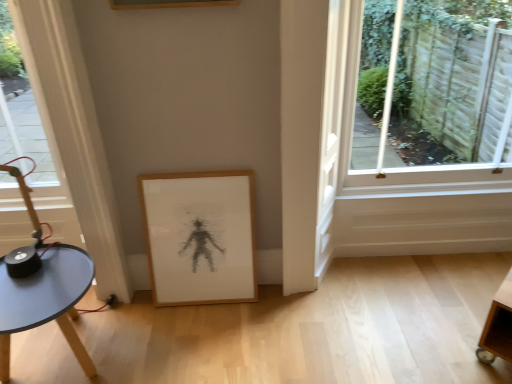
Question: Considering the positions of clear glass window at upper right and wooden picture frame at lower center in the image, is clear glass window at upper right taller or shorter than wooden picture frame at lower center?

Choices:
 (A) tall
 (B) short

Answer: (A)

Question: Considering the positions of clear glass window at upper right and wooden picture frame at lower center in the image, is clear glass window at upper right bigger or smaller than wooden picture frame at lower center?

Choices:
 (A) big
 (B) small

Answer: (A)

Question: Which is farther from the wooden picture frame at lower center?

Choices:
 (A) clear glass window at upper right
 (B) matte blue table at lower left

Answer: (A)

Question: Which object is the farthest from the matte blue table at lower left?

Choices:
 (A) wooden picture frame at lower center
 (B) clear glass window at upper right

Answer: (B)